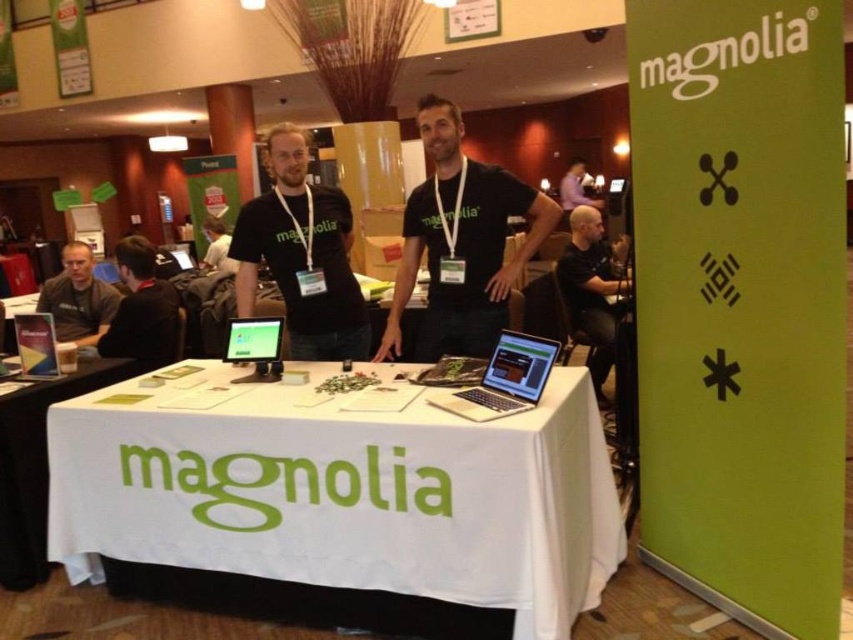
Question: Observing the image, what is the correct spatial positioning of white paper at lower left in reference to matte black shirt at left?

Choices:
 (A) right
 (B) left

Answer: (A)

Question: Is matte black t-shirt at center bigger than metallic silver laptop at center?

Choices:
 (A) no
 (B) yes

Answer: (B)

Question: Which point appears farthest from the camera in this image?

Choices:
 (A) (236, 362)
 (B) (523, 259)
 (C) (161, 364)

Answer: (C)

Question: Which of these objects is positioned farthest from the matte black laptop at upper center?

Choices:
 (A) white paper at lower left
 (B) matte black tablet at center
 (C) metallic silver laptop at center

Answer: (C)

Question: Can you confirm if white paper at lower left is positioned to the left of matte black laptop at upper center?

Choices:
 (A) yes
 (B) no

Answer: (A)

Question: Which object is positioned closest to the black matte t-shirt at center?

Choices:
 (A) black fabric shirt at center
 (B) white fabric table at center

Answer: (B)